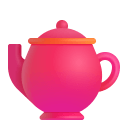
Find the location of a particular element. This screenshot has width=128, height=128. teapot base is located at coordinates (57, 116).